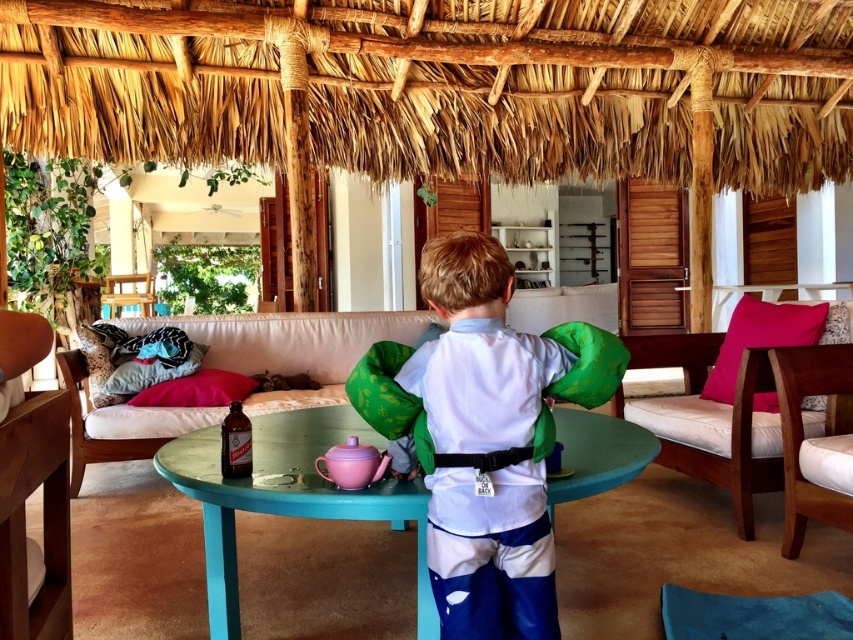
In the scene shown: Is white fabric couch at center taller than pink fabric pillow at center?

Indeed, white fabric couch at center has a greater height compared to pink fabric pillow at center.

Describe the element at coordinates (291, 342) in the screenshot. This screenshot has height=640, width=853. I see `white fabric couch at center` at that location.

Is point (376, 316) closer to camera compared to point (241, 394)?

No.

This screenshot has width=853, height=640. What are the coordinates of `white fabric couch at center` in the screenshot? It's located at (291, 342).

Does pink fabric pillow at right appear on the right side of pink fabric pillow at center?

Yes, pink fabric pillow at right is to the right of pink fabric pillow at center.

The image size is (853, 640). I want to click on pink fabric pillow at right, so click(x=759, y=337).

Locate an element on the screen. This screenshot has width=853, height=640. pink fabric pillow at right is located at coordinates (759, 337).

Where is `pink fabric pillow at right`? The image size is (853, 640). pink fabric pillow at right is located at coordinates (759, 337).

Does point (238, 323) come behind point (753, 353)?

Yes, it is behind point (753, 353).

Is point (332, 356) positioned behind point (715, 336)?

Yes.

Find the location of a particular element. white fabric couch at center is located at coordinates (291, 342).